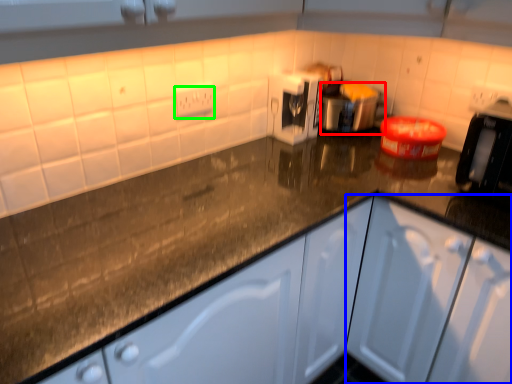
Question: Estimate the real-world distances between objects in this image. Which object is farther from appliance (highlighted by a red box), cabinetry (highlighted by a blue box) or electric outlet (highlighted by a green box)?

Choices:
 (A) cabinetry
 (B) electric outlet

Answer: (A)